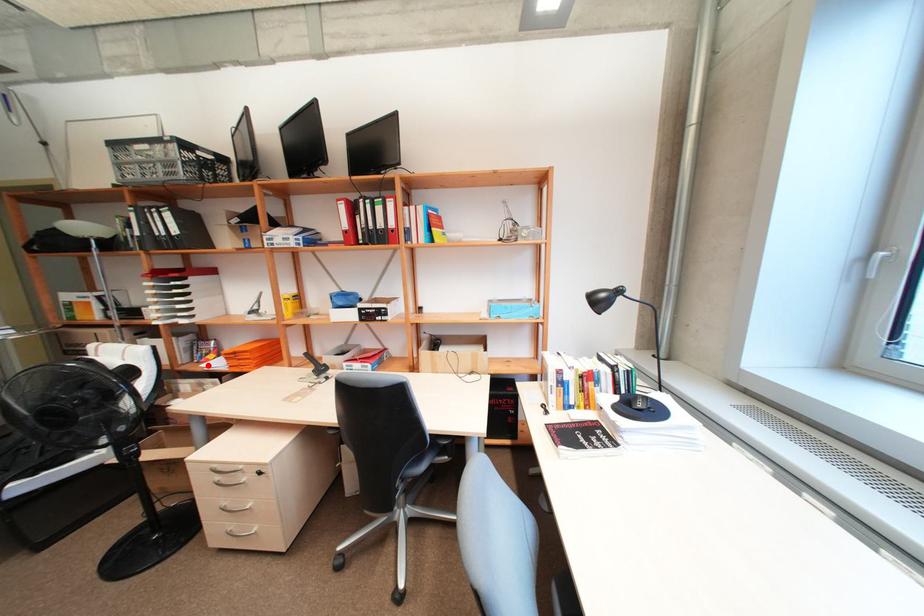
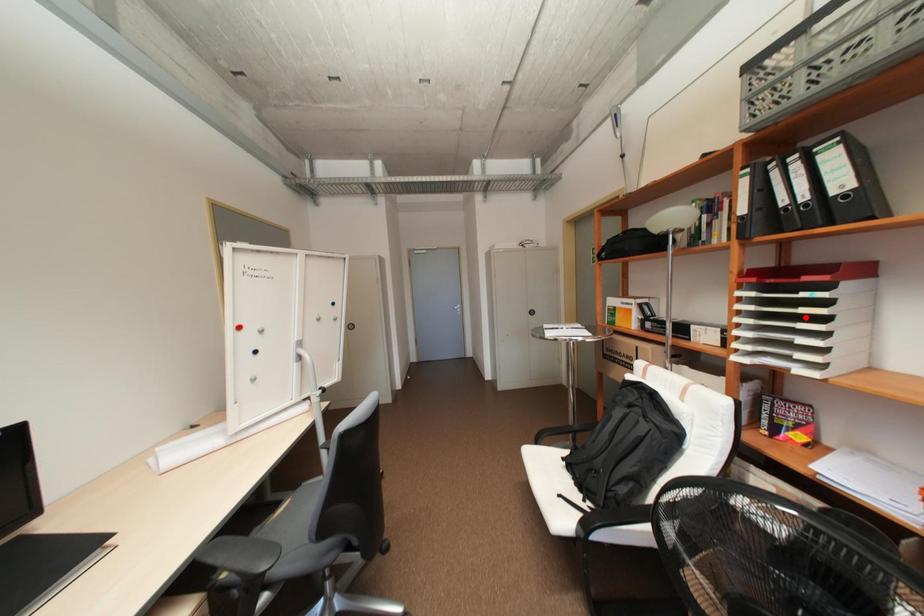
I am providing you with two images of the same scene from different viewpoints. A red point is marked on the first image and another point is marked on the second image. Are the points marked in image1 and image2 representing the same 3D position?

No